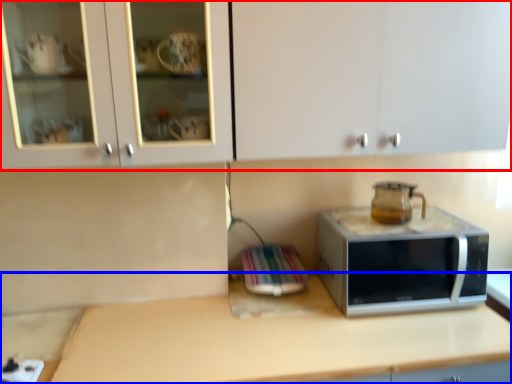
Question: Which point is further to the camera, cabinetry (highlighted by a red box) or countertop (highlighted by a blue box)?

Choices:
 (A) cabinetry
 (B) countertop

Answer: (B)